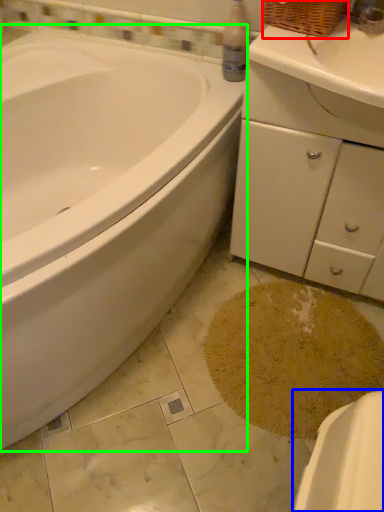
Question: Estimate the real-world distances between objects in this image. Which object is closer to basket (highlighted by a red box), porcelain (highlighted by a blue box) or bathtub (highlighted by a green box)?

Choices:
 (A) porcelain
 (B) bathtub

Answer: (B)